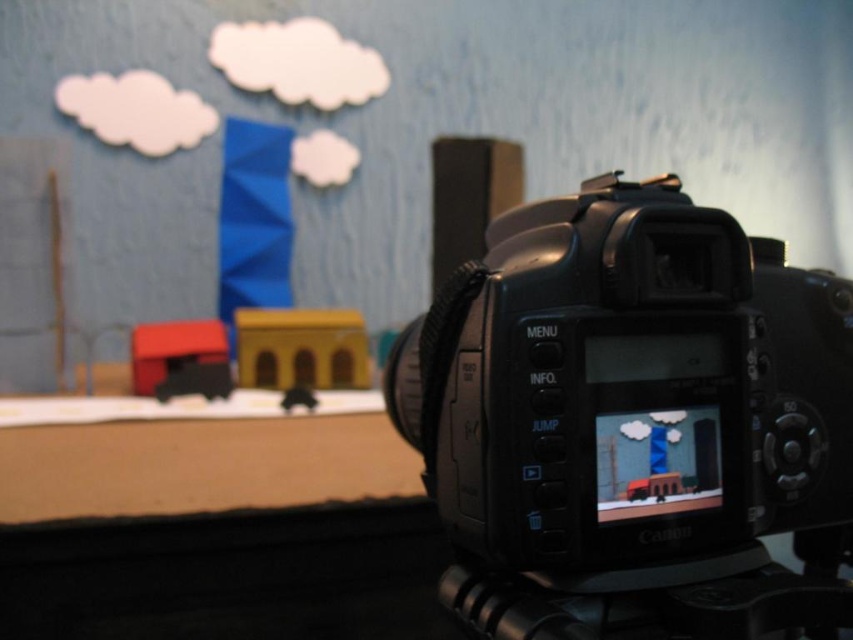
You are a photographer setting up a stop motion animation scene. You have two points marked in the scene for camera positioning. The first point is at coordinates point [770,384] and the second point is at point [576,612]. Which point is closer to the camera lens?

Point [770,384] is further to the viewer than point [576,612], so the point closer to the camera lens is point [576,612].

You are a photographer trying to set up a tripod for a stop motion animation. You need to place a new tripod in the scene so that it does not block the camera at point (627,385). Where should you place the tripod?

The tripod should be placed away from the black plastic camera at center to avoid blocking it. Since the camera is at point (627,385), placing the tripod in an area not overlapping with this coordinate would ensure it doesn not obstruct the camera.

You are setting up a camera for a stop motion animation. The matte paper clouds at upper center are part of the background, and the black rubber tripod at lower center holds the camera. How far apart are these two items in the scene?

The distance between the matte paper clouds at upper center and the black rubber tripod at lower center is 1.65 meters.